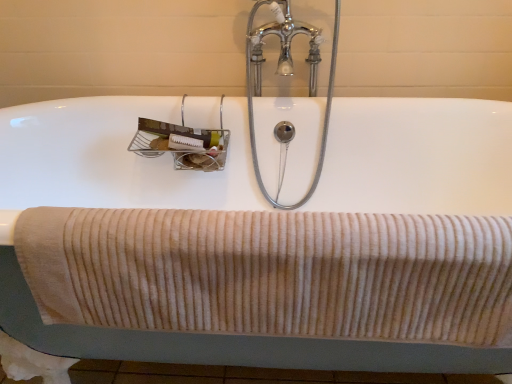
Question: Does white ceramic bath at center have a greater width compared to chrome/metallic faucet at upper center?

Choices:
 (A) no
 (B) yes

Answer: (B)

Question: Is the position of white ceramic bath at center less distant than that of chrome/metallic faucet at upper center?

Choices:
 (A) yes
 (B) no

Answer: (A)

Question: Considering the relative positions of white ceramic bath at center and chrome/metallic faucet at upper center in the image provided, is white ceramic bath at center to the right of chrome/metallic faucet at upper center from the viewer's perspective?

Choices:
 (A) yes
 (B) no

Answer: (B)

Question: Would you say white ceramic bath at center is outside chrome/metallic faucet at upper center?

Choices:
 (A) no
 (B) yes

Answer: (B)

Question: Is white ceramic bath at center bigger than chrome/metallic faucet at upper center?

Choices:
 (A) yes
 (B) no

Answer: (A)

Question: Is white ceramic bath at center smaller than chrome/metallic faucet at upper center?

Choices:
 (A) no
 (B) yes

Answer: (A)

Question: Can white ceramic bath at center be found inside beige corduroy towel at lower center?

Choices:
 (A) yes
 (B) no

Answer: (B)

Question: From the image's perspective, is beige corduroy towel at lower center beneath white ceramic bath at center?

Choices:
 (A) no
 (B) yes

Answer: (A)

Question: Considering the relative sizes of beige corduroy towel at lower center and white ceramic bath at center in the image provided, is beige corduroy towel at lower center wider than white ceramic bath at center?

Choices:
 (A) yes
 (B) no

Answer: (B)

Question: Is beige corduroy towel at lower center oriented towards white ceramic bath at center?

Choices:
 (A) yes
 (B) no

Answer: (A)

Question: From the image's perspective, is beige corduroy towel at lower center above white ceramic bath at center?

Choices:
 (A) no
 (B) yes

Answer: (B)

Question: Is beige corduroy towel at lower center looking in the opposite direction of white ceramic bath at center?

Choices:
 (A) no
 (B) yes

Answer: (B)

Question: Would you consider beige corduroy towel at lower center to be distant from chrome/metallic faucet at upper center?

Choices:
 (A) yes
 (B) no

Answer: (B)